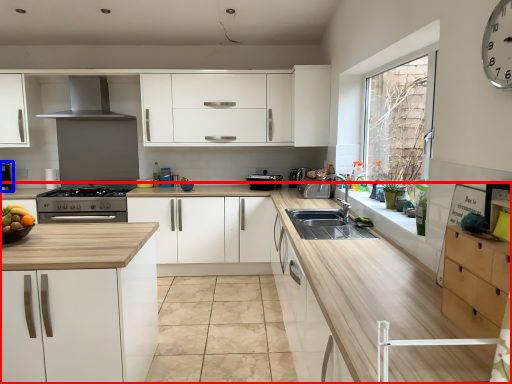
Question: Which of the following is the closest to the observer, countertop (highlighted by a red box) or coffee machine (highlighted by a blue box)?

Choices:
 (A) countertop
 (B) coffee machine

Answer: (A)